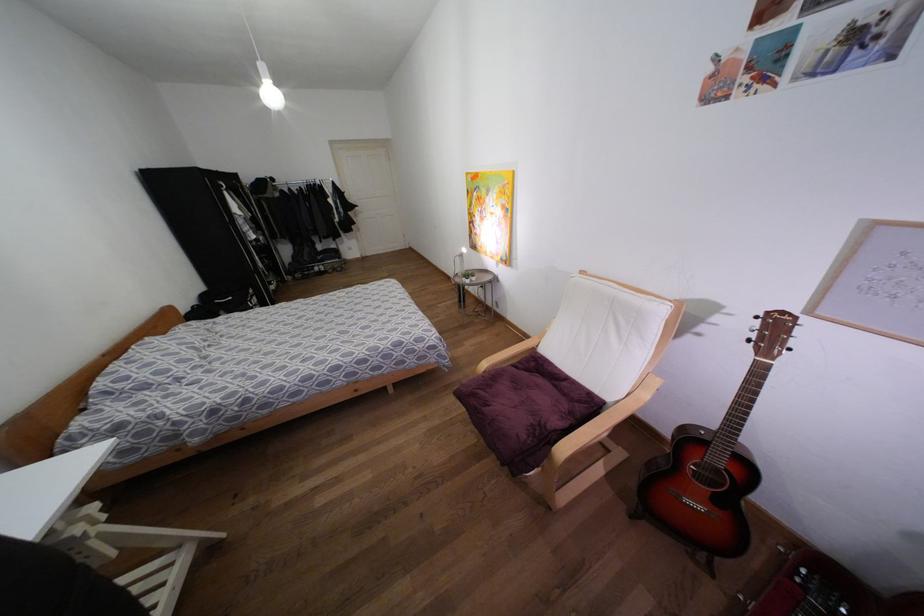
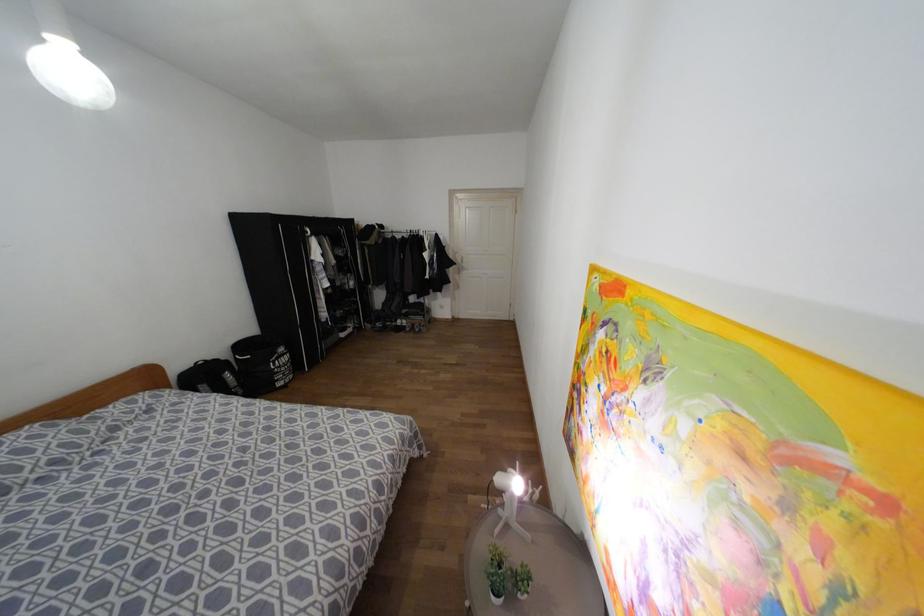
The point at (250, 291) is marked in the first image. Where is the corresponding point in the second image?

(281, 349)